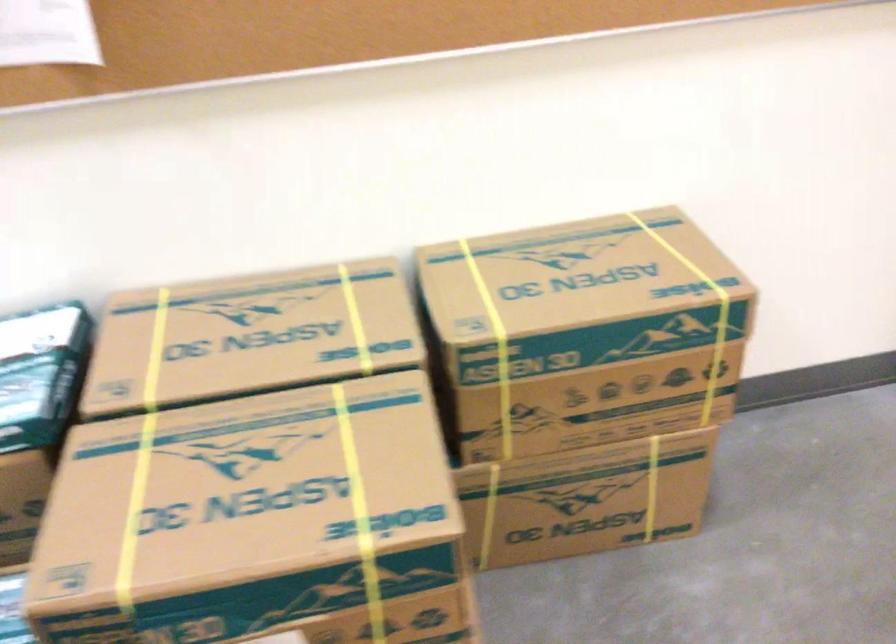
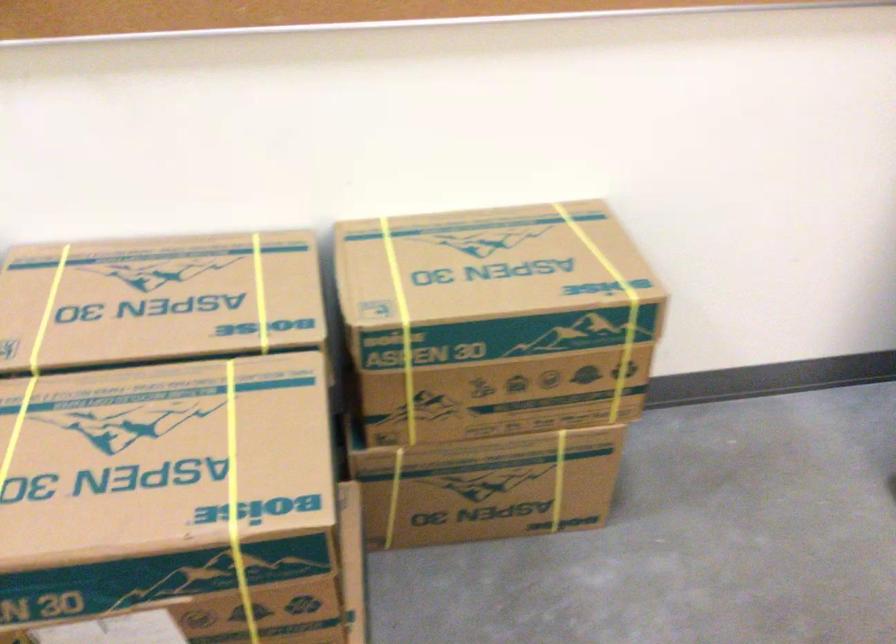
Locate, in the second image, the point that corresponds to (698,305) in the first image.

(609, 304)